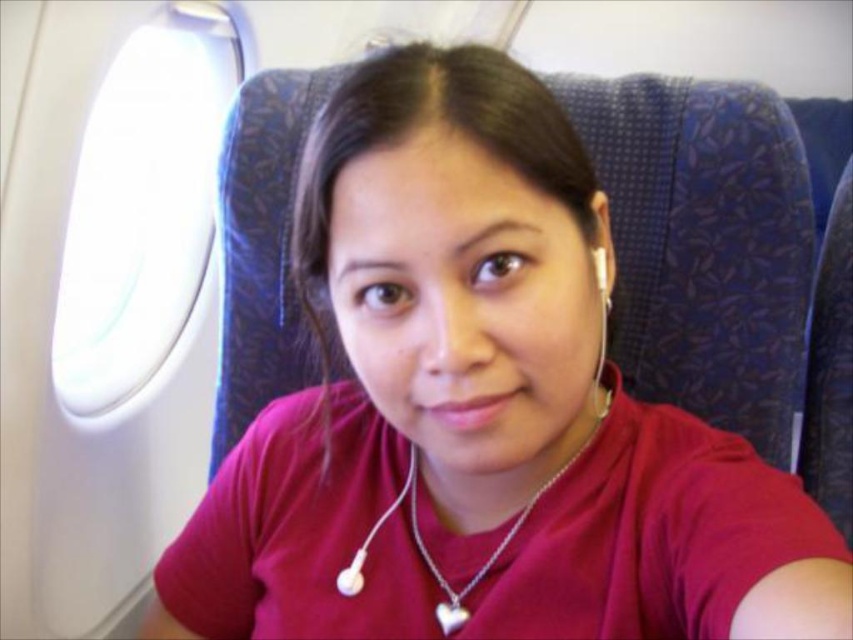
Which of these two, transparent plastic airplane window at upper left or silver/chain heart at center, stands taller?

With more height is transparent plastic airplane window at upper left.

Can you confirm if transparent plastic airplane window at upper left is thinner than silver/chain heart at center?

No.

Does point (190, 13) lie behind point (515, 525)?

Yes, point (190, 13) is behind point (515, 525).

The height and width of the screenshot is (640, 853). I want to click on transparent plastic airplane window at upper left, so click(142, 205).

Is silver/chain heart at center positioned at the back of white earbud at center?

No, silver/chain heart at center is closer to the viewer.

Does point (416, 490) lie in front of point (419, 536)?

No.

Who is more distant from viewer, (503, 536) or (346, 595)?

Positioned behind is point (346, 595).

This screenshot has height=640, width=853. Find the location of `silver/chain heart at center`. silver/chain heart at center is located at coordinates click(502, 541).

Does transparent plastic airplane window at upper left have a larger size compared to white earbud at center?

Correct, transparent plastic airplane window at upper left is larger in size than white earbud at center.

From the picture: Does transparent plastic airplane window at upper left appear on the right side of white earbud at center?

Incorrect, transparent plastic airplane window at upper left is not on the right side of white earbud at center.

Describe the element at coordinates (142, 205) in the screenshot. I see `transparent plastic airplane window at upper left` at that location.

Find the location of a particular element. transparent plastic airplane window at upper left is located at coordinates (142, 205).